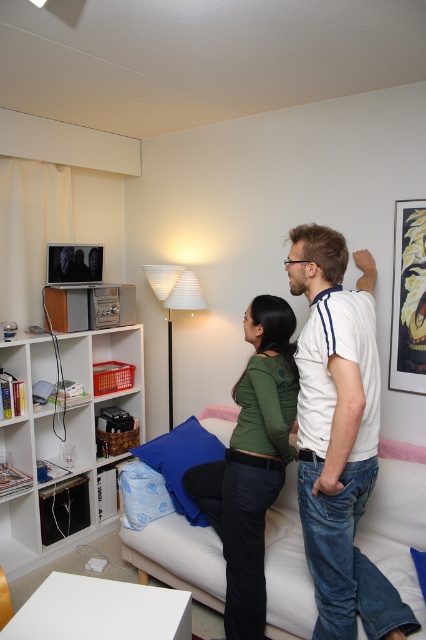
Question: Among these points, which one is farthest from the camera?

Choices:
 (A) (339, 548)
 (B) (216, 448)
 (C) (287, 484)
 (D) (11, 522)

Answer: (D)

Question: Which point is farther to the camera?

Choices:
 (A) white plastic bookshelf at left
 (B) soft fabric couch at center

Answer: (A)

Question: Which object is positioned closest to the white cotton t-shirt at upper center?

Choices:
 (A) blue fabric pillow at lower center
 (B) green matte shirt at center
 (C) white plastic bookshelf at left
 (D) blue fabric pillow at center

Answer: (B)

Question: Observing the image, what is the correct spatial positioning of white cotton t-shirt at upper center in reference to blue fabric pillow at center?

Choices:
 (A) below
 (B) above

Answer: (B)

Question: In this image, where is white cotton t-shirt at upper center located relative to blue fabric pillow at center?

Choices:
 (A) left
 (B) right

Answer: (B)

Question: Is green matte shirt at center positioned in front of blue fabric pillow at center?

Choices:
 (A) yes
 (B) no

Answer: (A)